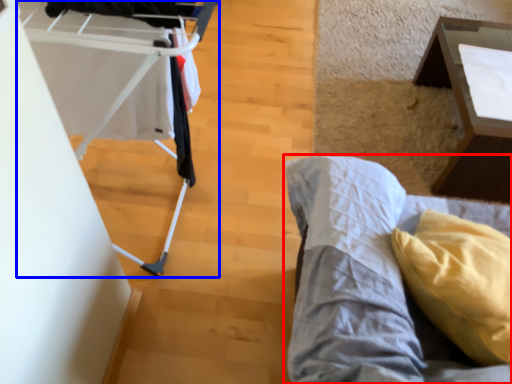
Question: Which of the following is the farthest to the observer, furniture (highlighted by a red box) or baby carriage (highlighted by a blue box)?

Choices:
 (A) furniture
 (B) baby carriage

Answer: (B)